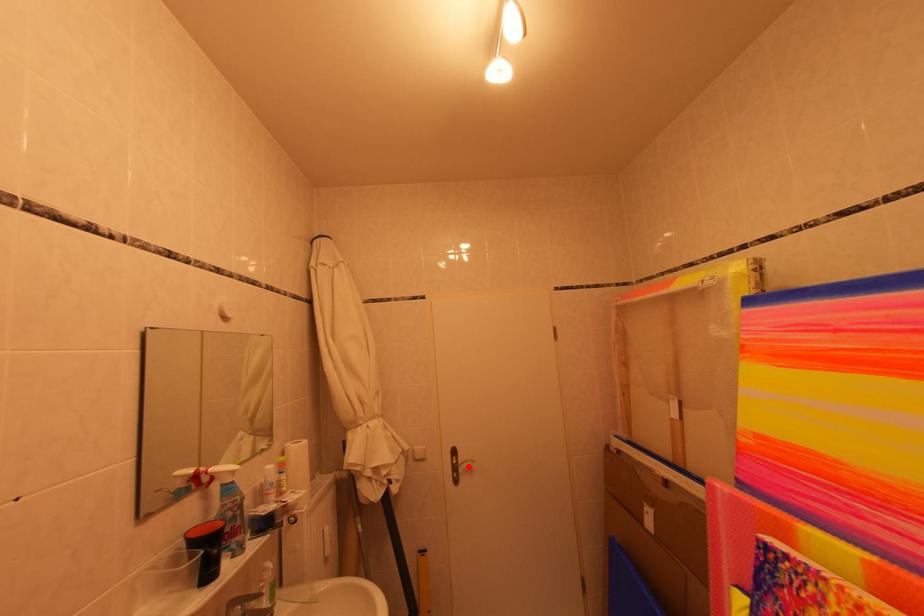
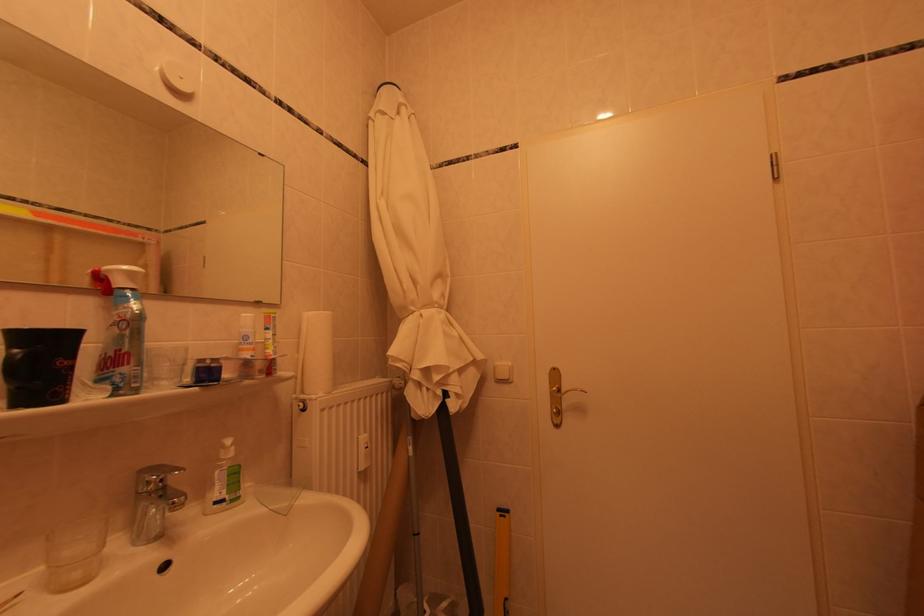
Find the pixel in the second image that matches the highlighted location in the first image.

(572, 395)